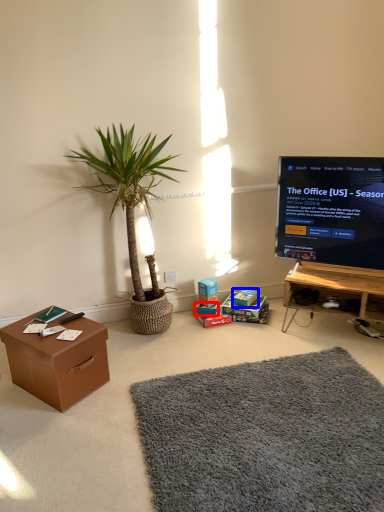
Question: Which object appears farthest to the camera in this image, box (highlighted by a red box) or storage box (highlighted by a blue box)?

Choices:
 (A) box
 (B) storage box

Answer: (A)